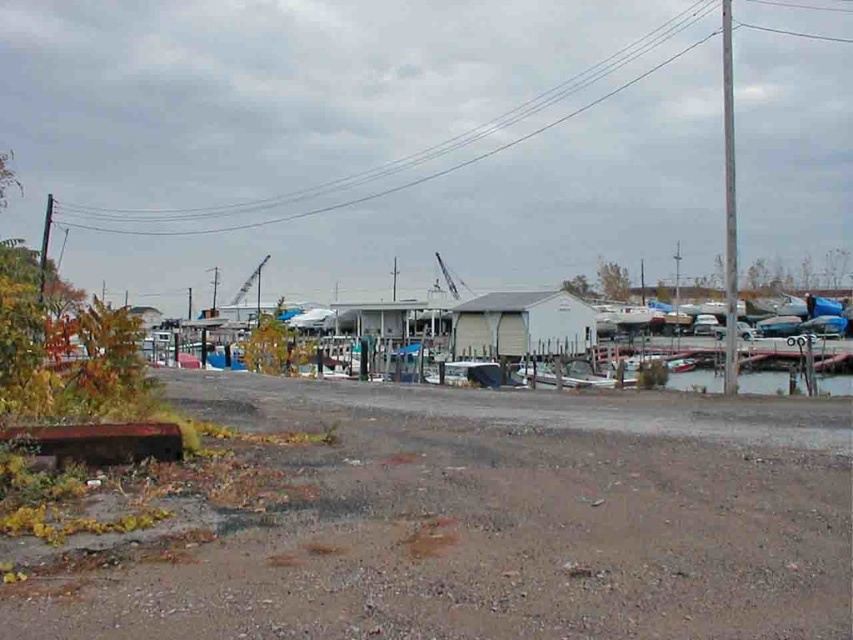
Between dull brown dirt track at lower left and clear water at lower right, which one appears on the right side from the viewer's perspective?

clear water at lower right

Looking at this image, is dull brown dirt track at lower left further to camera compared to clear water at lower right?

No.

What do you see at coordinates (503, 522) in the screenshot? This screenshot has height=640, width=853. I see `dull brown dirt track at lower left` at bounding box center [503, 522].

In order to click on dull brown dirt track at lower left in this screenshot , I will do `click(503, 522)`.

Does clear water at lower right appear over white matte boat at center?

No, clear water at lower right is not above white matte boat at center.

Between point (712, 385) and point (548, 364), which one is positioned behind?

The point (548, 364) is behind.

Measure the distance between point (698,384) and camera.

Point (698,384) and camera are 48.82 meters apart from each other.

Find the location of a particular element. clear water at lower right is located at coordinates (763, 381).

Is dull brown dirt track at lower left positioned at the back of white matte boat at center?

No, it is not.

Is dull brown dirt track at lower left below white matte boat at center?

No, dull brown dirt track at lower left is not below white matte boat at center.

Is point (589, 532) farther from viewer compared to point (552, 384)?

No, (589, 532) is in front of (552, 384).

This screenshot has height=640, width=853. Find the location of `dull brown dirt track at lower left`. dull brown dirt track at lower left is located at coordinates (503, 522).